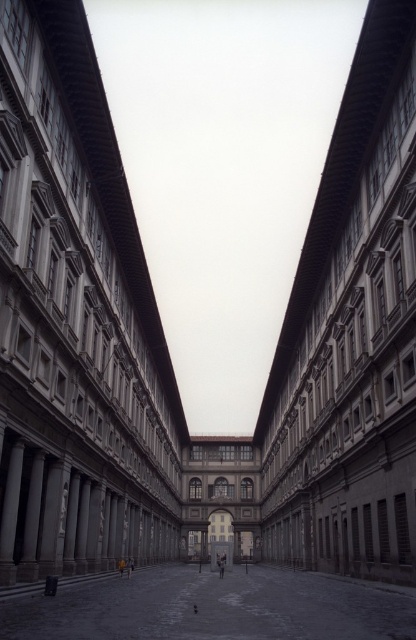
Consider the image. You are an architect designing a new structure that must fit within the existing gray stone building at center and smooth stone courtyard at center. Given their sizes, which object should your new structure be placed adjacent to for better spatial harmony?

The gray stone building at center is larger in size than the smooth stone courtyard at center, so the new structure should be placed adjacent to the gray stone building at center to maintain proportional balance.

You are standing in the courtyard looking up towards the sky. Where is the matte gray building at center located in this scene?

The matte gray building at center is located at the central lower part of the scene, as its 2D coordinates are at point 0.502 on the x axis and 0.183 on the y axis.